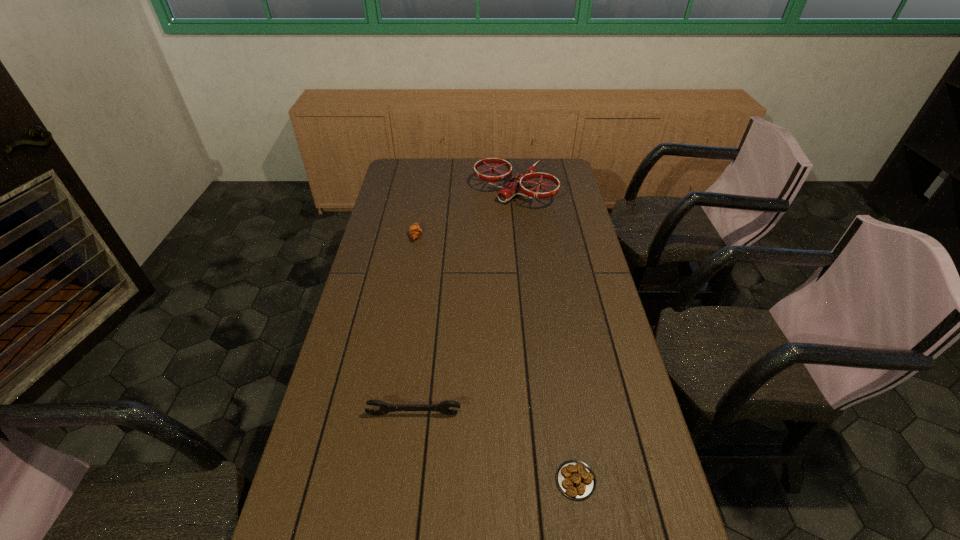
Image resolution: width=960 pixels, height=540 pixels. What are the coordinates of `free location located 0.250m on the front-facing side of the left pastry` in the screenshot? It's located at click(x=486, y=235).

The height and width of the screenshot is (540, 960). What are the coordinates of `free spot located on the back of the nearest object` in the screenshot? It's located at pos(564,403).

I want to click on object that is at the far edge, so click(x=514, y=185).

Locate an element on the screen. wrench located at the left edge is located at coordinates (443, 407).

This screenshot has height=540, width=960. In order to click on pastry situated at the left edge in this screenshot , I will do pyautogui.click(x=415, y=231).

At what (x,y) coordinates should I click in order to perform the action: click on drone present at the right edge. Please return your answer as a coordinate pair (x, y). This screenshot has width=960, height=540. Looking at the image, I should click on (514, 185).

Locate an element on the screen. This screenshot has height=540, width=960. pastry that is at the right edge is located at coordinates (575, 479).

What are the coordinates of `object positioned at the far right corner` in the screenshot? It's located at (514, 185).

The image size is (960, 540). Find the location of `vacant space at the far edge of the desktop`. vacant space at the far edge of the desktop is located at coordinates (466, 163).

Locate an element on the screen. Image resolution: width=960 pixels, height=540 pixels. vacant area at the left edge of the desktop is located at coordinates (370, 241).